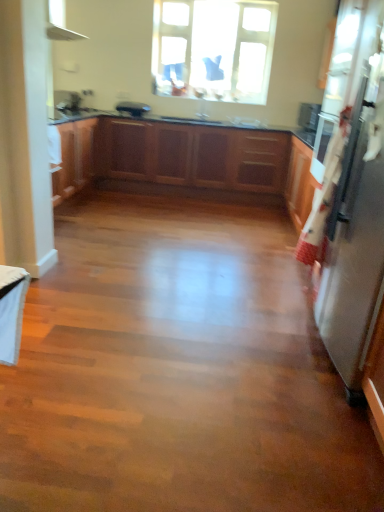
Locate an element on the screen. This screenshot has width=384, height=512. vacant space to the left of satin silver refrigerator at right, arranged as the first appliance when ordered from the bottom is located at coordinates (230, 347).